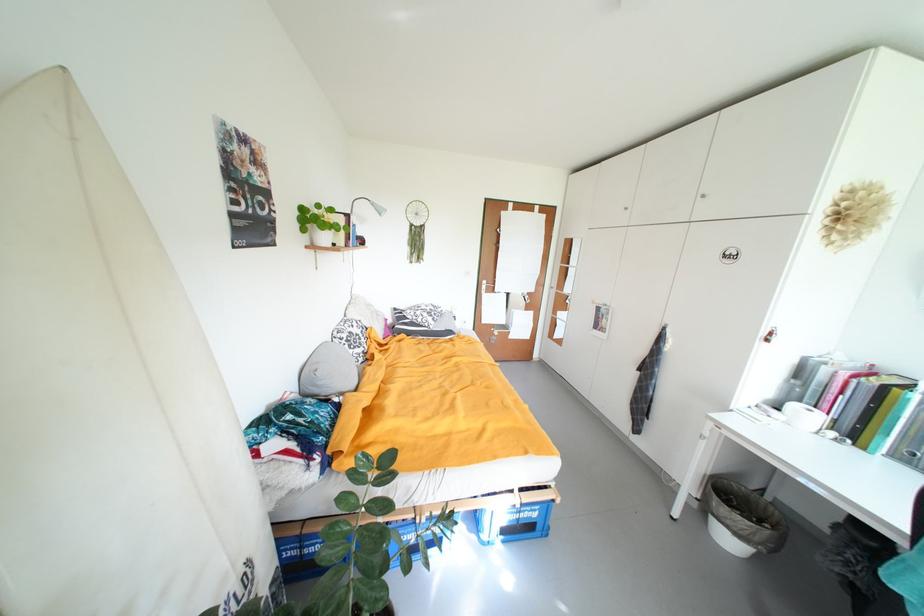
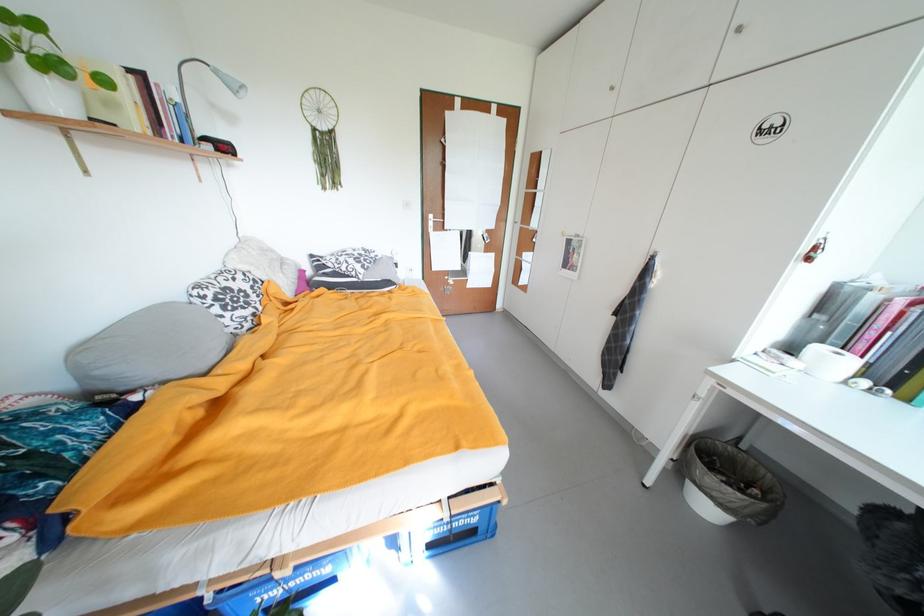
Find the pixel in the second image that matches (736,544) in the first image.

(714, 509)